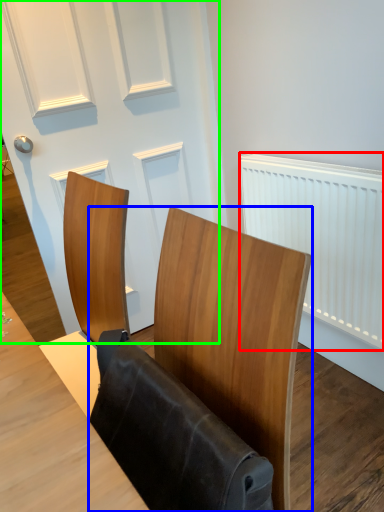
Question: Which object is positioned closest to radiator (highlighted by a red box)? Select from furniture (highlighted by a blue box) and door (highlighted by a green box).

Choices:
 (A) furniture
 (B) door

Answer: (B)